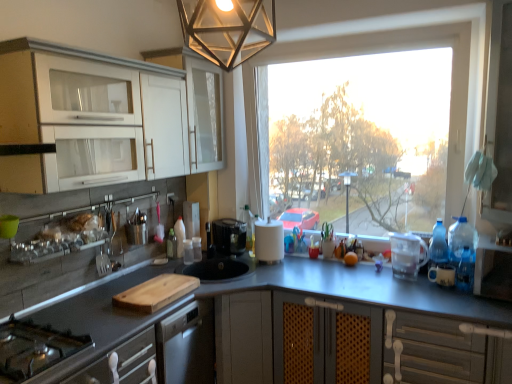
This screenshot has width=512, height=384. Identify the location of unoccupied area in front of blue plastic bottle at right, the 3th bottle when ordered from left to right. (439, 296).